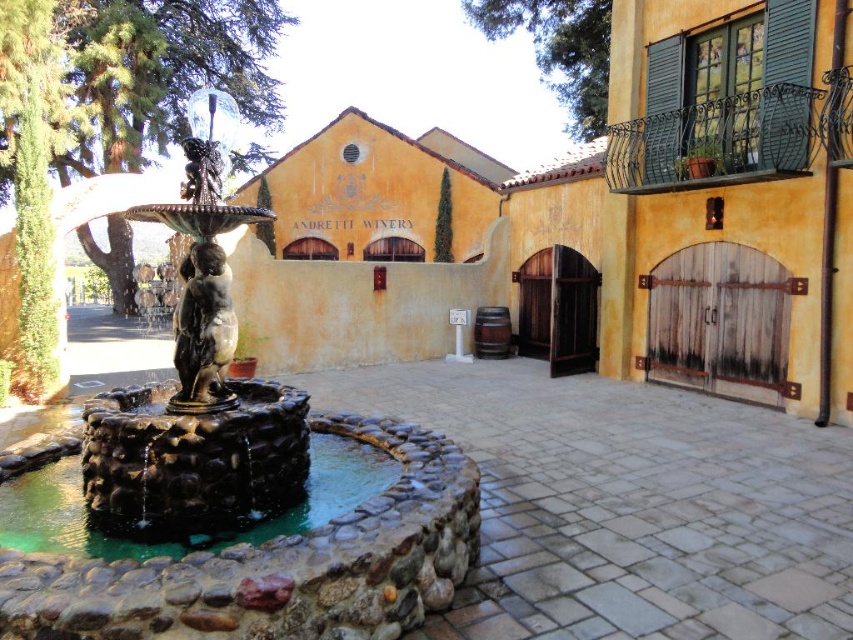
Question: Considering the real-world distances, which object is farthest from the polished bronze statue at center?

Choices:
 (A) bronze statue at center
 (B) green stone fountain at center

Answer: (B)

Question: Can you confirm if polished bronze statue at center is positioned below green stone fountain at center?

Choices:
 (A) yes
 (B) no

Answer: (B)

Question: Among these objects, which one is nearest to the camera?

Choices:
 (A) green stone fountain at center
 (B) polished bronze statue at center
 (C) bronze statue at center

Answer: (A)

Question: Which of the following is the closest to the observer?

Choices:
 (A) bronze statue at center
 (B) polished bronze statue at center
 (C) green stone fountain at center

Answer: (C)

Question: Observing the image, what is the correct spatial positioning of polished bronze statue at center in reference to bronze statue at center?

Choices:
 (A) left
 (B) right

Answer: (A)

Question: Can you confirm if polished bronze statue at center is thinner than green stone fountain at center?

Choices:
 (A) no
 (B) yes

Answer: (B)